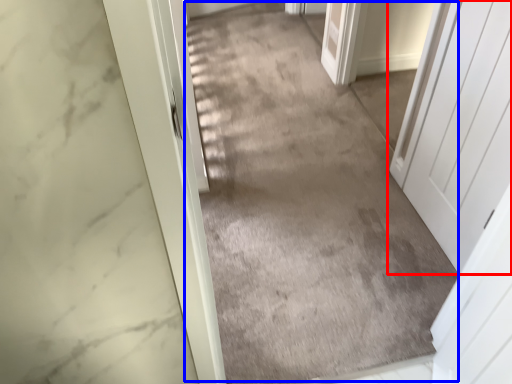
Question: Among these objects, which one is farthest to the camera, door (highlighted by a red box) or path (highlighted by a blue box)?

Choices:
 (A) door
 (B) path

Answer: (B)